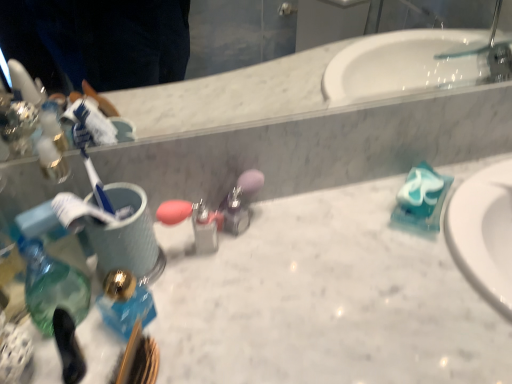
Find the location of `vacant space to the right of translucent glass soap dispenser at left`. vacant space to the right of translucent glass soap dispenser at left is located at coordinates (206, 312).